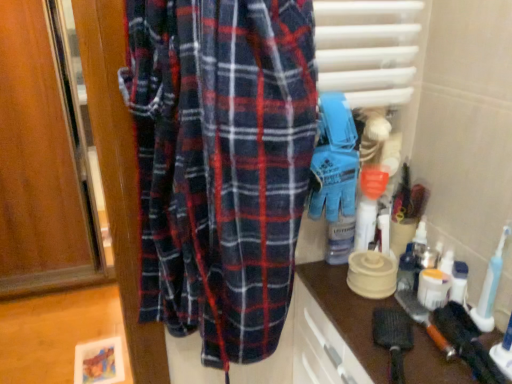
The image size is (512, 384). I want to click on black rubber toothbrush at lower right, so click(423, 319).

What is the approximate height of brown matte countertop at lower right?

brown matte countertop at lower right is 57.12 centimeters in height.

Describe the element at coordinates (348, 314) in the screenshot. The height and width of the screenshot is (384, 512). I see `brown matte countertop at lower right` at that location.

This screenshot has width=512, height=384. Identify the location of black rubber toothbrush at lower right. (423, 319).

Between black rubber toothbrush at lower right and brown matte countertop at lower right, which one appears on the left side from the viewer's perspective?

Positioned to the left is brown matte countertop at lower right.

Is brown matte countertop at lower right surrounded by black rubber toothbrush at lower right?

No, brown matte countertop at lower right is not a part of black rubber toothbrush at lower right.

Is black rubber toothbrush at lower right in contact with brown matte countertop at lower right?

black rubber toothbrush at lower right and brown matte countertop at lower right are not in contact.

Considering the sizes of objects blue rubber gloves at center and black rubber toothbrush at lower right in the image provided, who is shorter, blue rubber gloves at center or black rubber toothbrush at lower right?

black rubber toothbrush at lower right is shorter.

Is blue rubber gloves at center closer to the viewer compared to black rubber toothbrush at lower right?

Yes, blue rubber gloves at center is in front of black rubber toothbrush at lower right.

Can you tell me how much blue rubber gloves at center and black rubber toothbrush at lower right differ in facing direction?

There is a 90-degree angle between the facing directions of blue rubber gloves at center and black rubber toothbrush at lower right.

Considering the sizes of objects black rubber toothbrush at lower right and blue rubber gloves at center in the image provided, who is wider, black rubber toothbrush at lower right or blue rubber gloves at center?

blue rubber gloves at center is wider.

Considering the positions of point (404, 288) and point (325, 93), is point (404, 288) closer or farther from the camera than point (325, 93)?

Clearly, point (404, 288) is more distant from the camera than point (325, 93).

Does black rubber toothbrush at lower right appear on the right side of blue rubber gloves at center?

Yes.

Which object is further away from the camera, black rubber toothbrush at lower right or blue rubber gloves at center?

black rubber toothbrush at lower right.

How many degrees apart are the facing directions of blue rubber gloves at center and brown matte countertop at lower right?

They differ by 90 degrees in their facing directions.

In order to click on toy above the brown matte countertop at lower right (from a real-world perspective) in this screenshot , I will do `click(334, 160)`.

Would you consider blue rubber gloves at center to be distant from brown matte countertop at lower right?

No, blue rubber gloves at center is not far from brown matte countertop at lower right.

From a real-world perspective, is blue rubber gloves at center physically located above or below brown matte countertop at lower right?

blue rubber gloves at center is above brown matte countertop at lower right.

In the scene shown: Measure the distance from brown matte countertop at lower right to blue rubber gloves at center.

brown matte countertop at lower right and blue rubber gloves at center are 11.95 inches apart from each other.

Where is `counter below the blue rubber gloves at center (from the image's perspective)`? The height and width of the screenshot is (384, 512). counter below the blue rubber gloves at center (from the image's perspective) is located at coordinates (348, 314).

Is point (370, 323) less distant than point (321, 122)?

No, (370, 323) is further to viewer.

Is brown matte countertop at lower right located outside blue rubber gloves at center?

Yes, brown matte countertop at lower right is outside of blue rubber gloves at center.

Is brown matte countertop at lower right oriented away from black rubber toothbrush at lower right?

brown matte countertop at lower right does not have its back to black rubber toothbrush at lower right.

Considering the sizes of objects brown matte countertop at lower right and black rubber toothbrush at lower right in the image provided, who is bigger, brown matte countertop at lower right or black rubber toothbrush at lower right?

Bigger between the two is brown matte countertop at lower right.

Locate an element on the screen. This screenshot has width=512, height=384. counter in front of the black rubber toothbrush at lower right is located at coordinates (348, 314).

Is brown matte countertop at lower right not inside black rubber toothbrush at lower right?

Yes, brown matte countertop at lower right is located beyond the bounds of black rubber toothbrush at lower right.

At what (x,y) coordinates should I click in order to perform the action: click on counter in front of the black rubber toothbrush at lower right. Please return your answer as a coordinate pair (x, y). This screenshot has height=384, width=512. Looking at the image, I should click on [x=348, y=314].

Find the location of `toy above the black rubber toothbrush at lower right (from the image's perspective)`. toy above the black rubber toothbrush at lower right (from the image's perspective) is located at coordinates (334, 160).

When comparing their distances from brown matte countertop at lower right, does black rubber toothbrush at lower right or blue rubber gloves at center seem closer?

black rubber toothbrush at lower right lies closer to brown matte countertop at lower right than the other object.

When comparing their distances from brown matte countertop at lower right, does blue rubber gloves at center or black rubber toothbrush at lower right seem closer?

The object closer to brown matte countertop at lower right is black rubber toothbrush at lower right.

Looking at the image, which one is located further to black rubber toothbrush at lower right, brown matte countertop at lower right or blue rubber gloves at center?

Among the two, blue rubber gloves at center is located further to black rubber toothbrush at lower right.

Estimate the real-world distances between objects in this image. Which object is further from blue rubber gloves at center, black rubber toothbrush at lower right or brown matte countertop at lower right?

black rubber toothbrush at lower right.

Consider the image. Estimate the real-world distances between objects in this image. Which object is further from blue rubber gloves at center, brown matte countertop at lower right or black rubber toothbrush at lower right?

The object further to blue rubber gloves at center is black rubber toothbrush at lower right.

From the image, which object appears to be farther from black rubber toothbrush at lower right, blue rubber gloves at center or brown matte countertop at lower right?

blue rubber gloves at center.

The height and width of the screenshot is (384, 512). Find the location of `brush between blue rubber gloves at center and brown matte countertop at lower right vertically`. brush between blue rubber gloves at center and brown matte countertop at lower right vertically is located at coordinates (423, 319).